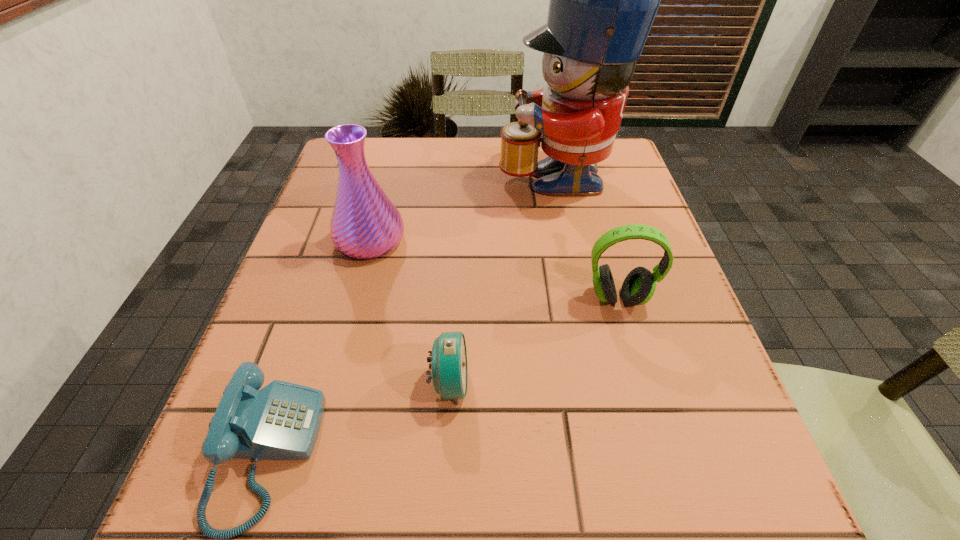
Where is `free space at the near edge of the desktop`? The height and width of the screenshot is (540, 960). free space at the near edge of the desktop is located at coordinates pyautogui.click(x=540, y=496).

Identify the location of vacant space at the left edge. (335, 291).

In the image, there is a desktop. Where is `blank space at the right edge`? This screenshot has height=540, width=960. blank space at the right edge is located at coordinates (703, 373).

The width and height of the screenshot is (960, 540). In the image, there is a desktop. In order to click on vacant region at the far left corner in this screenshot , I will do `click(374, 164)`.

Image resolution: width=960 pixels, height=540 pixels. Identify the location of blank space at the near right corner of the desktop. (751, 522).

The width and height of the screenshot is (960, 540). What are the coordinates of `vacant space that's between the nutcracker and the third object from right to left` in the screenshot? It's located at tap(502, 278).

The height and width of the screenshot is (540, 960). I want to click on vacant area that lies between the third object from right to left and the headset, so click(x=534, y=341).

The image size is (960, 540). Find the location of `free space between the headset and the second shortest object`. free space between the headset and the second shortest object is located at coordinates (534, 341).

I want to click on free area in between the third shortest object and the second tallest object, so click(x=494, y=269).

Where is `vacant space in between the second shortest object and the second farthest object`? The image size is (960, 540). vacant space in between the second shortest object and the second farthest object is located at coordinates (410, 312).